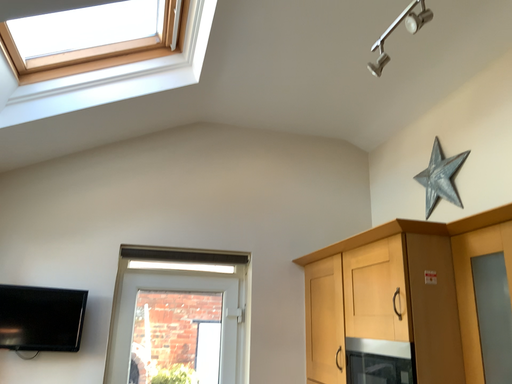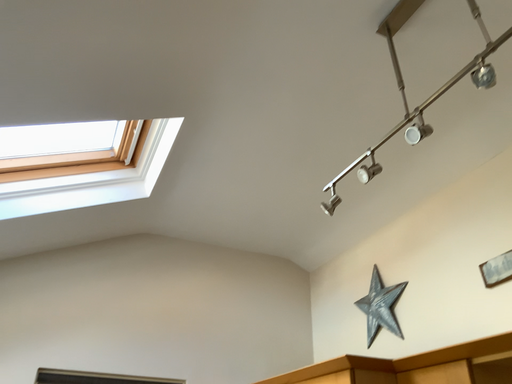
Question: How did the camera likely rotate when shooting the video?

Choices:
 (A) rotated downward
 (B) rotated upward

Answer: (B)